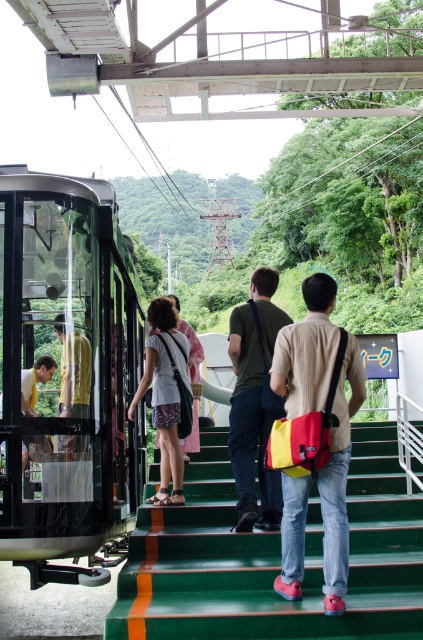
Between white cotton shirt at center and yellow matte shirt at center, which one has more height?

With more height is white cotton shirt at center.

Which of these two, white cotton shirt at center or yellow matte shirt at center, stands shorter?

yellow matte shirt at center is shorter.

Find the location of a particular element. white cotton shirt at center is located at coordinates (164, 394).

Image resolution: width=423 pixels, height=640 pixels. What are the coordinates of `white cotton shirt at center` in the screenshot? It's located at (164, 394).

Can you confirm if green fabric shirt at center is wider than yellow matte shirt at center?

Indeed, green fabric shirt at center has a greater width compared to yellow matte shirt at center.

The width and height of the screenshot is (423, 640). What do you see at coordinates (253, 401) in the screenshot? I see `green fabric shirt at center` at bounding box center [253, 401].

Identify the location of green fabric shirt at center. (253, 401).

Between transparent glass bus at left and green fabric shirt at center, which one appears on the right side from the viewer's perspective?

green fabric shirt at center is more to the right.

Locate an element on the screen. transparent glass bus at left is located at coordinates (68, 376).